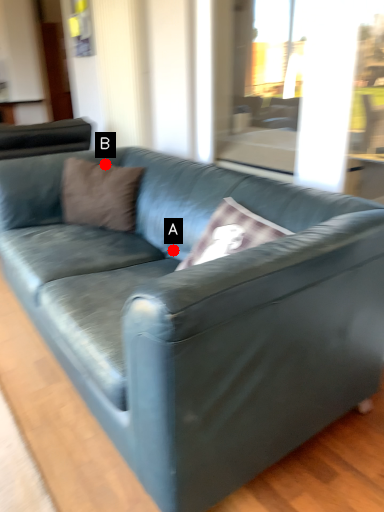
Question: Two points are circled on the image, labeled by A and B beside each circle. Which point is further to the camera?

Choices:
 (A) A is further
 (B) B is further

Answer: (B)